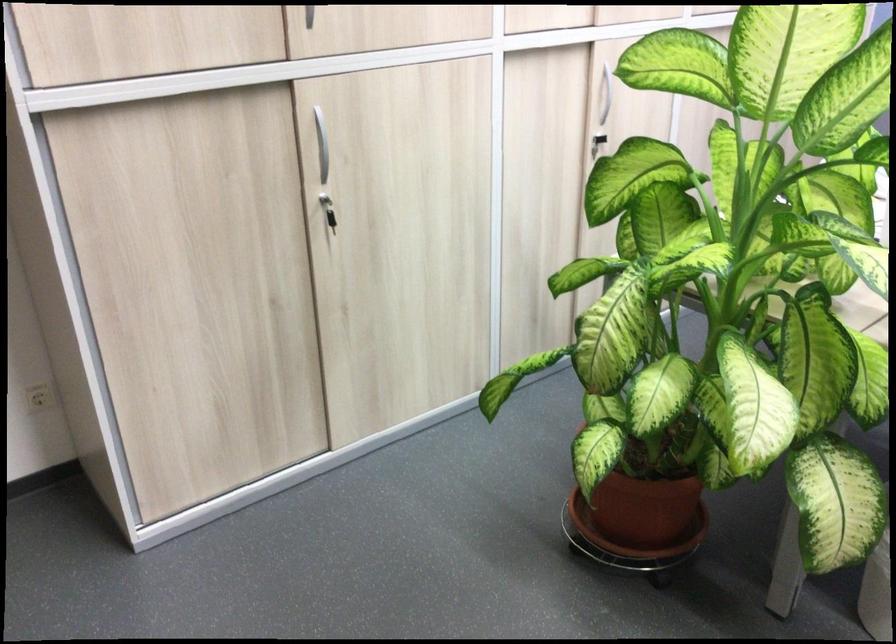
The location [643,509] corresponds to which object?

It corresponds to the brown plant pot in the image.